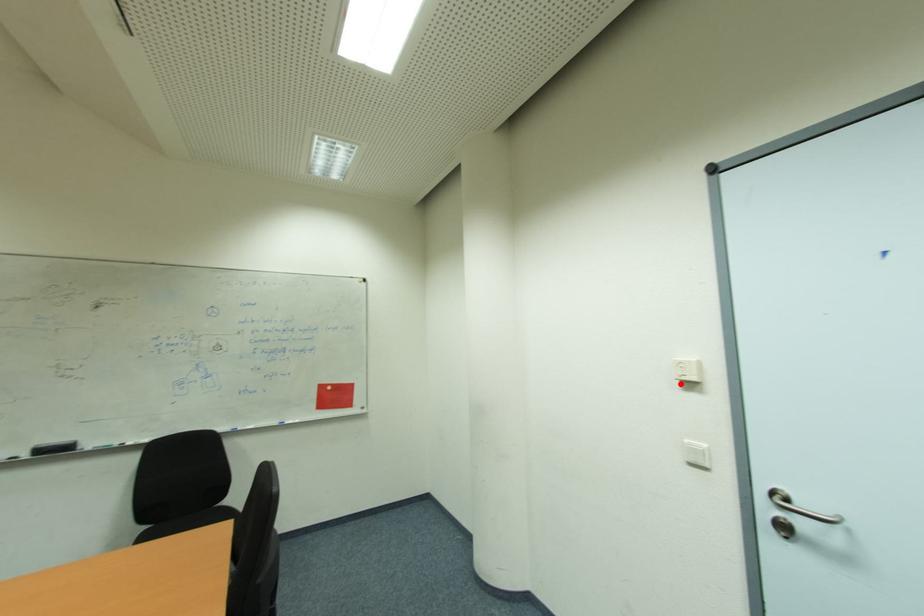
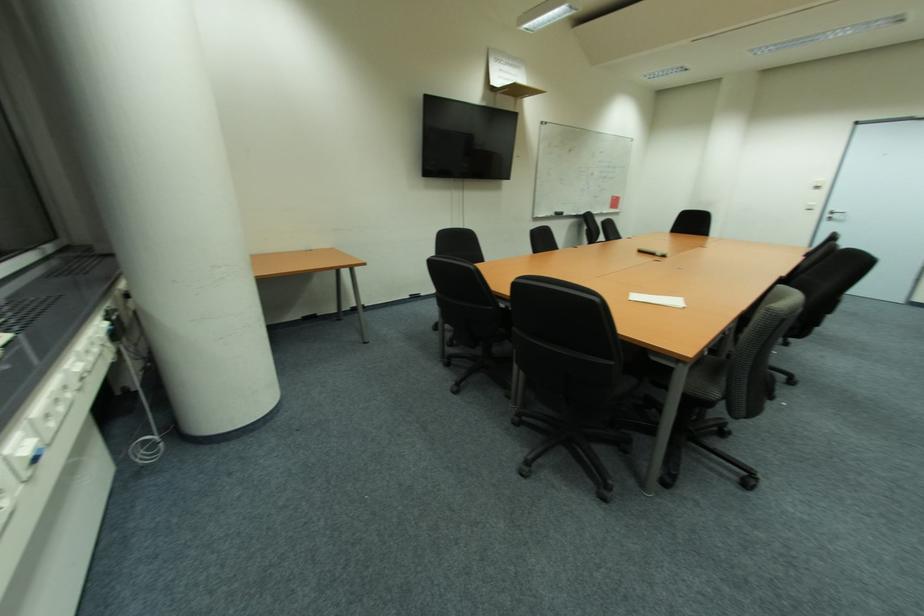
Question: I am providing you with two images of the same scene from different viewpoints. A red point is shown in image1. For the corresponding object point in image2, is it positioned nearer or farther from the camera?

Choices:
 (A) Nearer
 (B) Farther

Answer: (B)